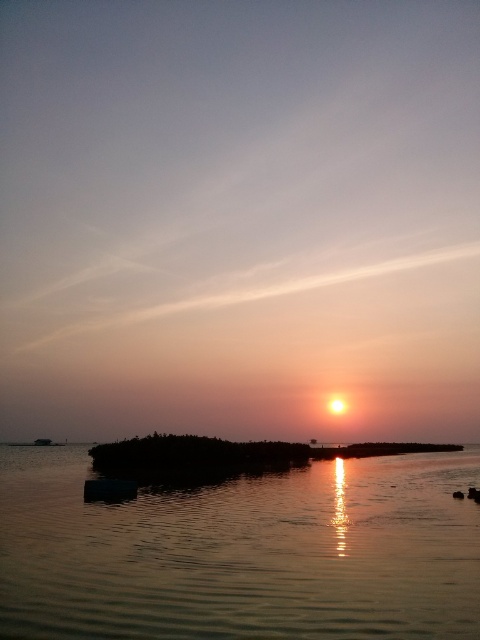
You are standing on the shore of the sunset scene and want to determine which of the two points, point (260, 532) or point (197, 448), is closer to you. Based on the coordinates provided, which point is nearer?

Point (260, 532) is closer to the camera than point (197, 448), so it is the nearer point.

You are a photographer trying to capture the sunset. You notice the silvery reflective water at center and the silky sand at center. Which one is located to the left of the other?

The silvery reflective water at center is positioned on the left side of silky sand at center.